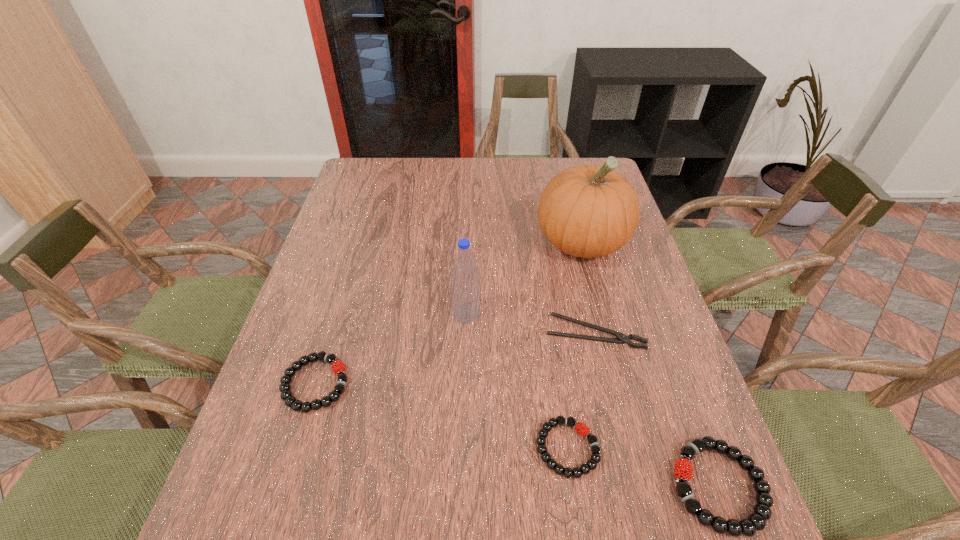
Find the location of a particular element. free space located 0.160m on the right of the second bracelet from right to left is located at coordinates (682, 448).

Where is `free region located on the left of the rightmost bracelet`? free region located on the left of the rightmost bracelet is located at coordinates (616, 486).

Locate an element on the screen. vacant position located on the back of the tongs is located at coordinates (570, 228).

This screenshot has width=960, height=540. I want to click on vacant space situated 0.340m on the left of the second tallest object, so click(317, 314).

Where is `free space located 0.130m on the stem of the tallest object`? The image size is (960, 540). free space located 0.130m on the stem of the tallest object is located at coordinates (599, 310).

This screenshot has height=540, width=960. I want to click on object at the left edge, so click(x=338, y=367).

Where is `bracelet that is positioned at the right edge`? bracelet that is positioned at the right edge is located at coordinates (756, 521).

The width and height of the screenshot is (960, 540). In order to click on tongs that is at the right edge in this screenshot , I will do `click(621, 338)`.

The image size is (960, 540). Find the location of `pumpkin that is at the right edge`. pumpkin that is at the right edge is located at coordinates (587, 211).

At what (x,y) coordinates should I click in order to perform the action: click on object at the near right corner. Please return your answer as a coordinate pair (x, y). Looking at the image, I should click on (756, 521).